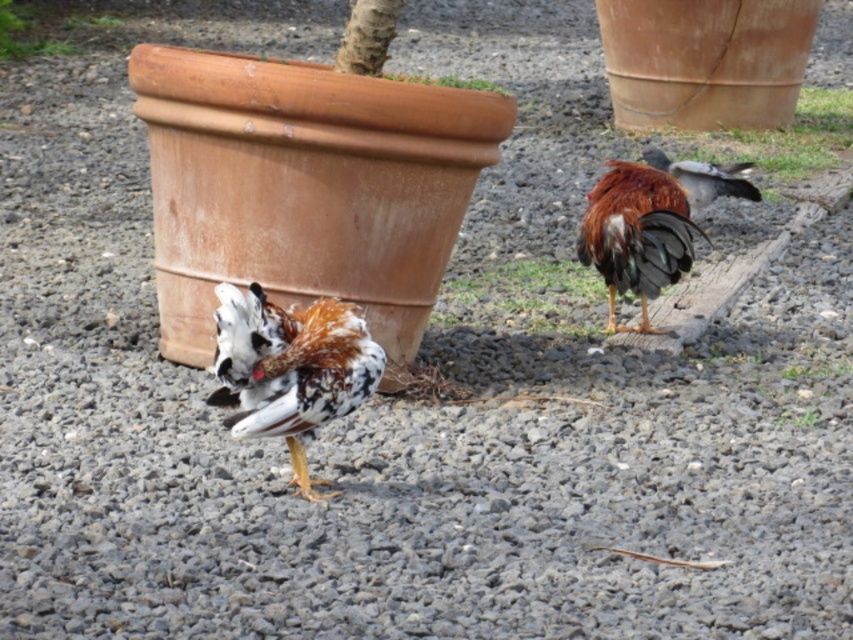
You are a photographer trying to capture a closeup of the birds in the image. You notice two specific points marked as point 1 at coordinates point (561, 317) and point 2 at coordinates point (26, 51). Which point should you focus on to ensure the closest bird is in sharp focus?

Point (561, 317) is closer to the camera than point (26, 51), so focusing on point (561, 317) will ensure the closest bird is in sharp focus.